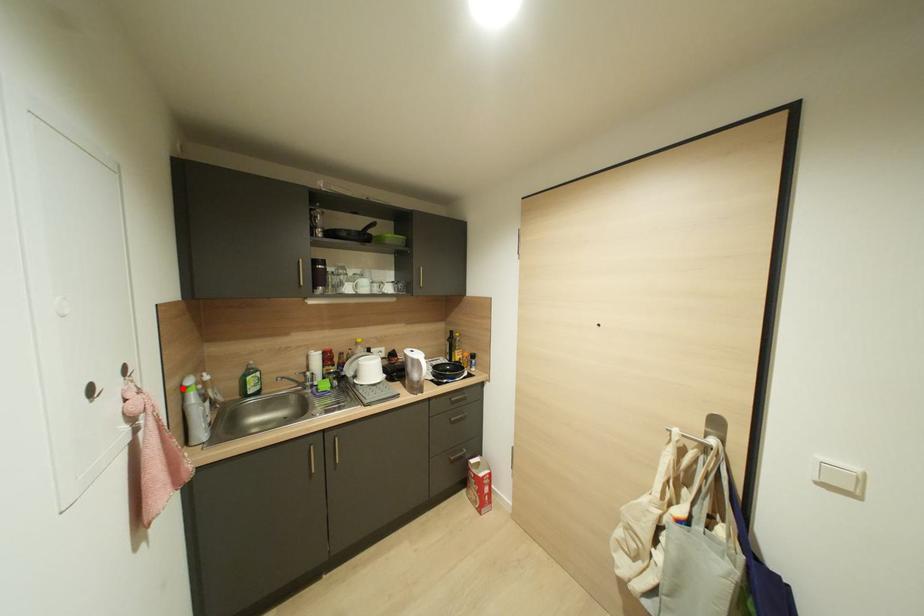
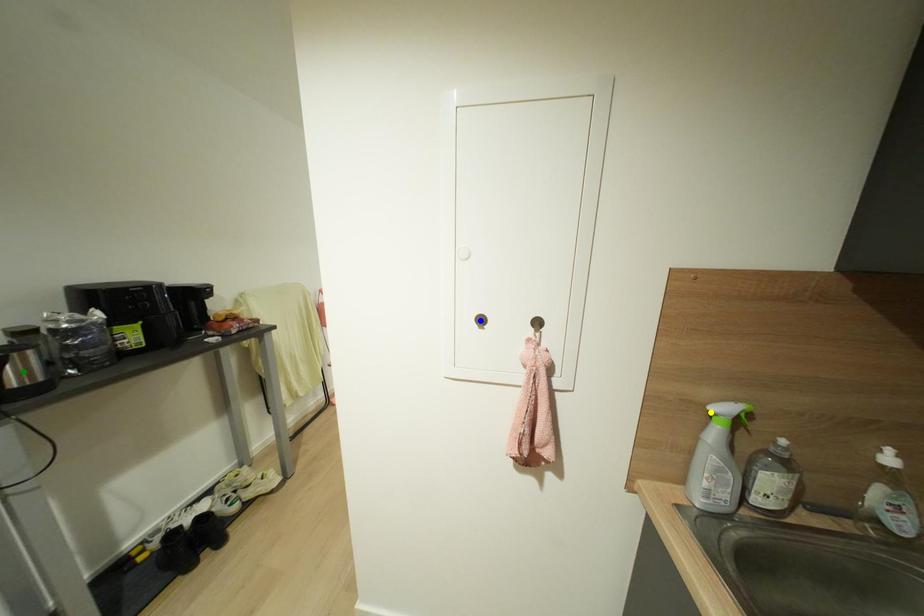
Question: I am providing you with two images of the same scene from different viewpoints. A red point is marked on the first image. You are given multiple points on the second image. Which mark in image 2 goes with the point in image 1?

Choices:
 (A) yellow point
 (B) green point
 (C) blue point

Answer: (A)